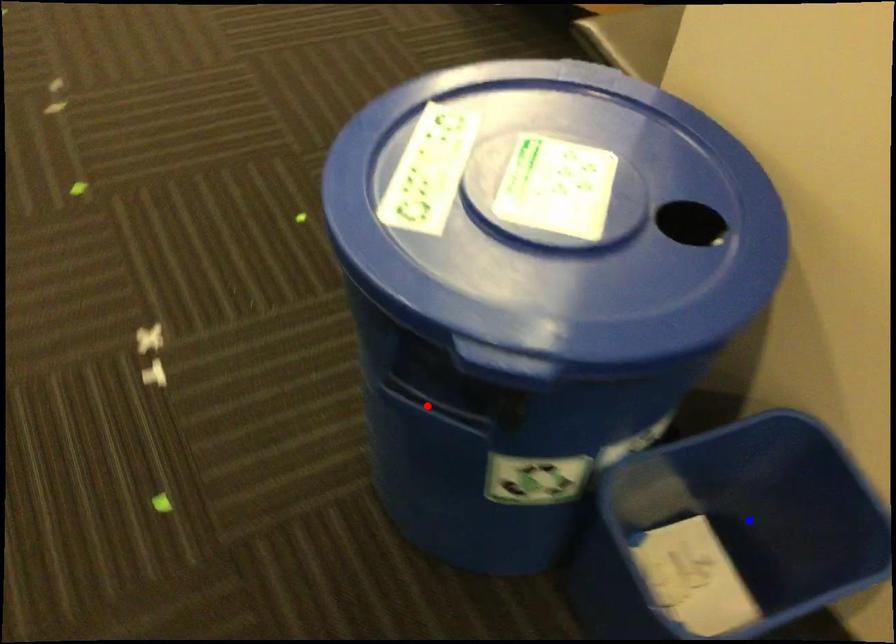
Question: Which of the two points in the image is closer to the camera?

Choices:
 (A) Blue point is closer.
 (B) Red point is closer.

Answer: (B)